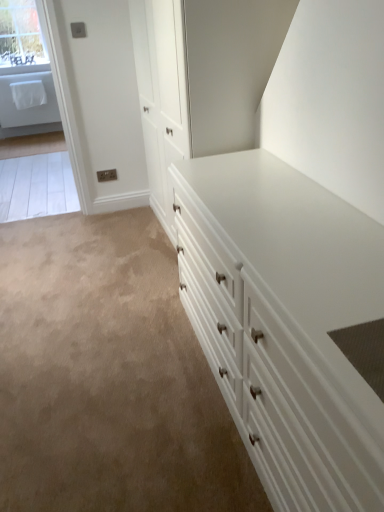
Question: Visually, is clear glass window at upper left positioned to the left or to the right of white glossy chest of drawers at center?

Choices:
 (A) right
 (B) left

Answer: (B)

Question: In terms of width, does clear glass window at upper left look wider or thinner when compared to white glossy chest of drawers at center?

Choices:
 (A) thin
 (B) wide

Answer: (A)

Question: Looking at the image, does clear glass window at upper left seem bigger or smaller compared to white glossy chest of drawers at center?

Choices:
 (A) big
 (B) small

Answer: (B)

Question: Is white glossy chest of drawers at center inside or outside of clear glass window at upper left?

Choices:
 (A) outside
 (B) inside

Answer: (A)

Question: From a real-world perspective, relative to clear glass window at upper left, is white glossy chest of drawers at center vertically above or below?

Choices:
 (A) above
 (B) below

Answer: (B)

Question: Looking at the image, does white glossy chest of drawers at center seem bigger or smaller compared to clear glass window at upper left?

Choices:
 (A) small
 (B) big

Answer: (B)

Question: Considering the positions of white glossy chest of drawers at center and clear glass window at upper left in the image, is white glossy chest of drawers at center wider or thinner than clear glass window at upper left?

Choices:
 (A) wide
 (B) thin

Answer: (A)